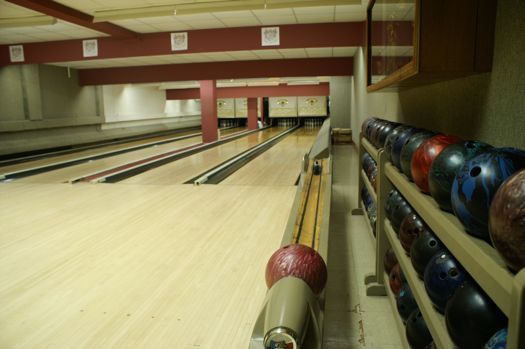
Image resolution: width=525 pixels, height=349 pixels. I want to click on trophy case, so click(418, 69), click(371, 87), click(369, 8), click(399, 20).